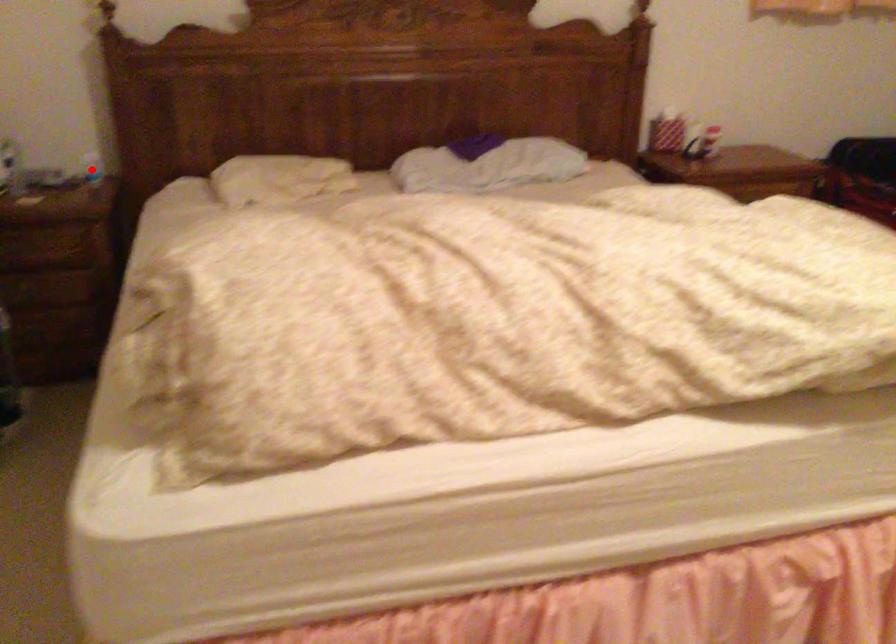
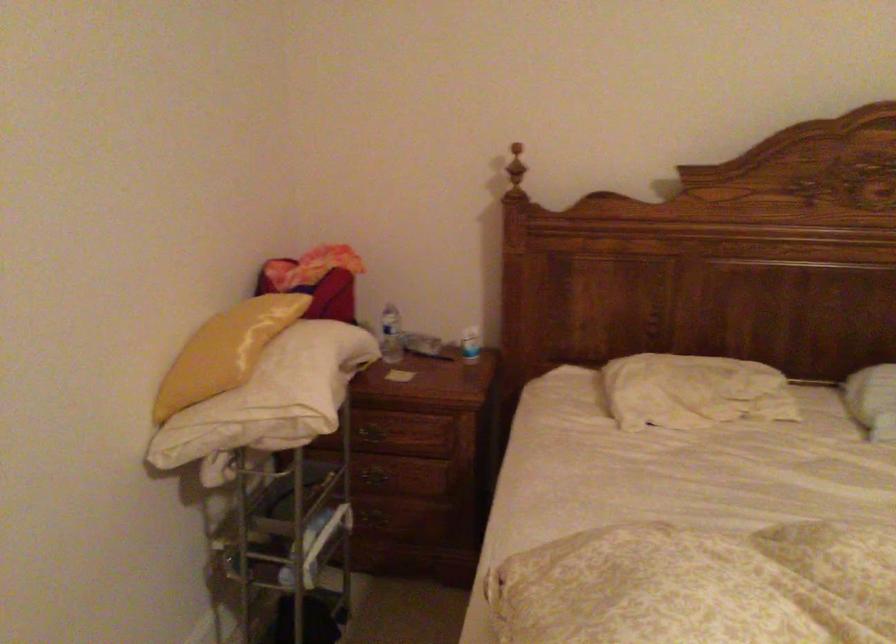
Find the pixel in the second image that matches the highlighted location in the first image.

(470, 344)